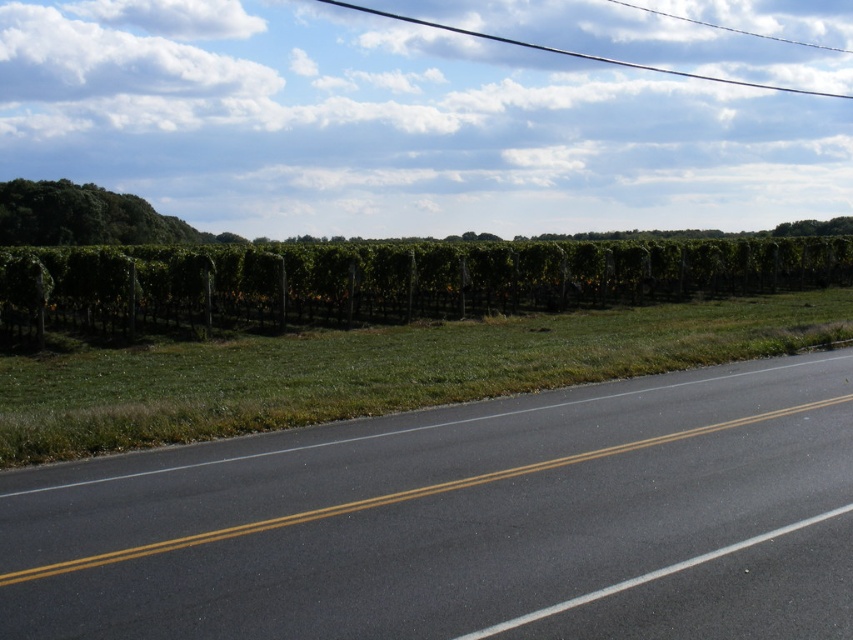
Question: Among these points, which one is nearest to the camera?

Choices:
 (A) (700, 461)
 (B) (810, 227)
 (C) (519, 285)
 (D) (141, 221)

Answer: (A)

Question: Which point is farther to the camera?

Choices:
 (A) (196, 492)
 (B) (817, 221)

Answer: (B)

Question: Which object appears closest to the camera in this image?

Choices:
 (A) green leafy tree at upper right
 (B) green leafy hedge at upper center

Answer: (B)

Question: Considering the relative positions of black asphalt highway at center and green leafy tree at upper right in the image provided, where is black asphalt highway at center located with respect to green leafy tree at upper right?

Choices:
 (A) right
 (B) left

Answer: (B)

Question: Does black asphalt highway at center appear over green leafy tree at upper left?

Choices:
 (A) no
 (B) yes

Answer: (A)

Question: Can you confirm if green leafy tree at upper left is thinner than green leafy tree at upper right?

Choices:
 (A) yes
 (B) no

Answer: (B)